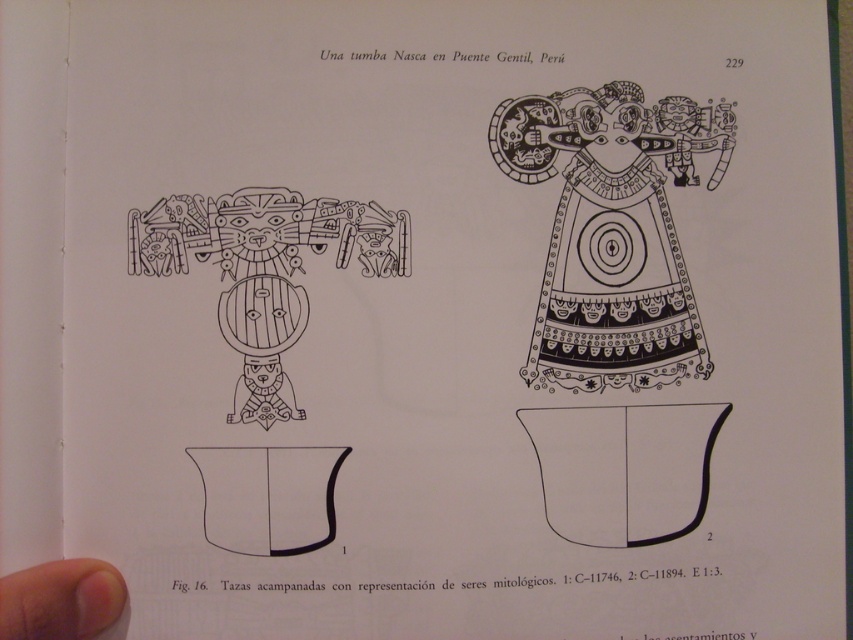
Question: Does black matte dress at center have a smaller size compared to wooden figure at center?

Choices:
 (A) no
 (B) yes

Answer: (A)

Question: Can you confirm if black matte dress at center is positioned above wooden figure at center?

Choices:
 (A) no
 (B) yes

Answer: (B)

Question: Is black matte dress at center thinner than wooden figure at center?

Choices:
 (A) yes
 (B) no

Answer: (B)